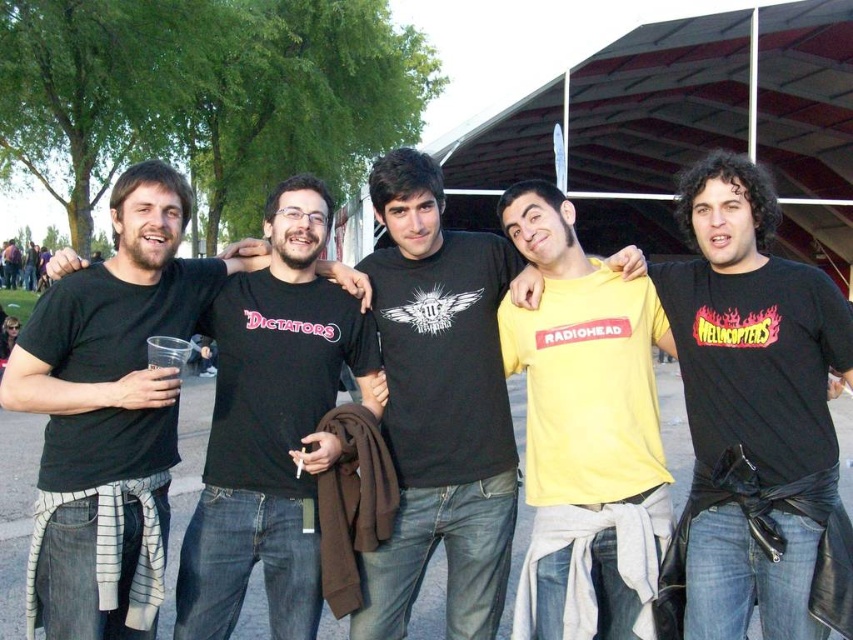
Which is more to the left, yellow matte shirt at center or yellow matte t-shirt at center?

From the viewer's perspective, yellow matte t-shirt at center appears more on the left side.

What do you see at coordinates (755, 419) in the screenshot?
I see `yellow matte shirt at center` at bounding box center [755, 419].

Does point (767, 577) come behind point (404, 600)?

No, (767, 577) is in front of (404, 600).

Identify the location of yellow matte shirt at center. This screenshot has height=640, width=853. (755, 419).

Is yellow matte t-shirt at center to the left of black matte t-shirt at left from the viewer's perspective?

In fact, yellow matte t-shirt at center is to the right of black matte t-shirt at left.

Is the position of yellow matte t-shirt at center more distant than that of black matte t-shirt at left?

Yes.

Which is behind, point (427, 198) or point (309, 372)?

Point (427, 198)

The image size is (853, 640). I want to click on yellow matte t-shirt at center, so [440, 404].

Between yellow matte shirt at center and black matte t-shirt at left, which one is positioned lower?

yellow matte shirt at center is lower down.

Is yellow matte shirt at center positioned behind black matte t-shirt at left?

Answer: No.

The width and height of the screenshot is (853, 640). What do you see at coordinates (755, 419) in the screenshot? I see `yellow matte shirt at center` at bounding box center [755, 419].

This screenshot has height=640, width=853. Identify the location of yellow matte shirt at center. (755, 419).